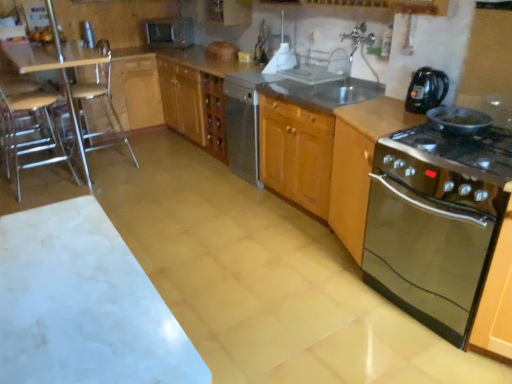
Question: Does wooden seat at left, which is the first bar stool from left to right, have a lesser height compared to satin silver microwave at upper center?

Choices:
 (A) no
 (B) yes

Answer: (A)

Question: From a real-world perspective, is wooden seat at left, which is the first bar stool from left to right, below satin silver microwave at upper center?

Choices:
 (A) yes
 (B) no

Answer: (A)

Question: Is wooden seat at left, which is the first bar stool from left to right, oriented away from satin silver microwave at upper center?

Choices:
 (A) yes
 (B) no

Answer: (B)

Question: Is wooden seat at left, arranged as the second bar stool when viewed from the right, positioned in front of satin silver microwave at upper center?

Choices:
 (A) no
 (B) yes

Answer: (B)

Question: From the image's perspective, would you say wooden seat at left, arranged as the second bar stool when viewed from the right, is positioned over satin silver microwave at upper center?

Choices:
 (A) yes
 (B) no

Answer: (B)

Question: From their relative heights in the image, would you say black plastic kettle at upper right, arranged as the 1th kitchen appliance when viewed from the top, is taller or shorter than satin silver dishwasher at center?

Choices:
 (A) short
 (B) tall

Answer: (A)

Question: In terms of width, does black plastic kettle at upper right, the second kitchen appliance in the bottom-to-top sequence, look wider or thinner when compared to satin silver dishwasher at center?

Choices:
 (A) thin
 (B) wide

Answer: (A)

Question: Is point (411, 97) positioned closer to the camera than point (249, 177)?

Choices:
 (A) closer
 (B) farther

Answer: (A)

Question: Choose the correct answer: Is black plastic kettle at upper right, arranged as the 1th kitchen appliance when viewed from the top, inside satin silver dishwasher at center or outside it?

Choices:
 (A) outside
 (B) inside

Answer: (A)

Question: Based on their positions, is stainless steel oven at right, the second cabinetry when ordered from back to front, located to the left or right of black plastic kettle at upper right, arranged as the 1th kitchen appliance when viewed from the top?

Choices:
 (A) right
 (B) left

Answer: (B)

Question: Based on their sizes in the image, would you say stainless steel oven at right, positioned as the 2th cabinetry in front-to-back order, is bigger or smaller than black plastic kettle at upper right, the second kitchen appliance in the bottom-to-top sequence?

Choices:
 (A) big
 (B) small

Answer: (A)

Question: From the image's perspective, relative to black plastic kettle at upper right, arranged as the 1th kitchen appliance when viewed from the top, is stainless steel oven at right, the second cabinetry when ordered from back to front, above or below?

Choices:
 (A) below
 (B) above

Answer: (A)

Question: Is point (334, 213) positioned closer to the camera than point (404, 99)?

Choices:
 (A) farther
 (B) closer

Answer: (A)

Question: Considering the relative positions of black glass stove at right, acting as the 1th kitchen appliance starting from the bottom, and stainless steel oven at right, positioned as the 2th cabinetry in front-to-back order, in the image provided, is black glass stove at right, acting as the 1th kitchen appliance starting from the bottom, to the left or to the right of stainless steel oven at right, positioned as the 2th cabinetry in front-to-back order,?

Choices:
 (A) right
 (B) left

Answer: (A)

Question: Do you think black glass stove at right, the 2th kitchen appliance when ordered from top to bottom, is within stainless steel oven at right, positioned as the 2th cabinetry in front-to-back order, or outside of it?

Choices:
 (A) outside
 (B) inside

Answer: (A)